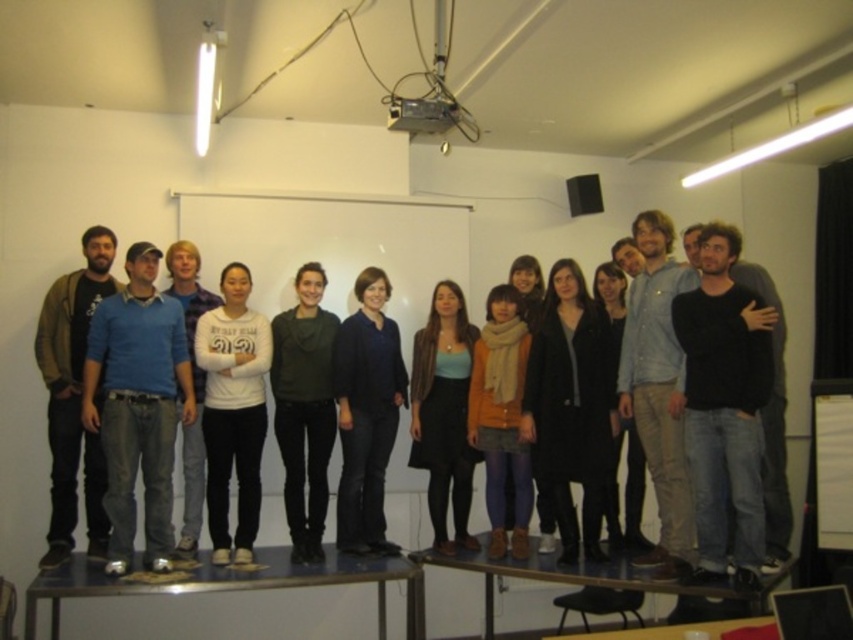
Question: Is blue fabric jacket at center thinner than blue cotton shirt at center?

Choices:
 (A) yes
 (B) no

Answer: (B)

Question: Which object is the farthest from the matte black dress at center?

Choices:
 (A) white matte sweater at center
 (B) orange sweater at center
 (C) dark gray sweater at center

Answer: (A)

Question: Based on their relative distances, which object is nearer to the white matte sweater at center?

Choices:
 (A) dark brown leather jacket at left
 (B) matte black dress at center

Answer: (A)

Question: Can you confirm if blue sweater at center is bigger than dark brown leather jacket at left?

Choices:
 (A) yes
 (B) no

Answer: (A)

Question: Can you confirm if matte black dress at center is positioned below orange sweater at center?

Choices:
 (A) yes
 (B) no

Answer: (B)

Question: Which object is the closest to the black wool coat at center?

Choices:
 (A) dark brown leather jacket at left
 (B) blue sweater at center
 (C) matte black dress at center
 (D) blue cotton shirt at center

Answer: (C)